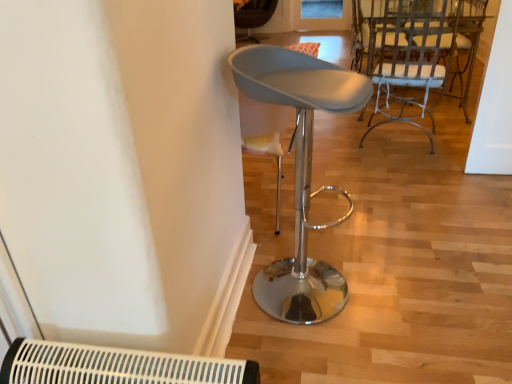
What do you see at coordinates (418, 52) in the screenshot? The width and height of the screenshot is (512, 384). I see `white painted metal chair at upper right, the 1th chair from the right` at bounding box center [418, 52].

Where is `velvet brown chair at center, the third chair in the bottom-to-top sequence`? velvet brown chair at center, the third chair in the bottom-to-top sequence is located at coordinates (252, 16).

Between white plastic air conditioning unit at lower left and white painted metal chair at upper right, the 2th chair viewed from the front, which one has smaller width?

Thinner between the two is white plastic air conditioning unit at lower left.

Between white plastic air conditioning unit at lower left and white painted metal chair at upper right, the 2th chair viewed from the front, which one is positioned in front?

Positioned in front is white plastic air conditioning unit at lower left.

What's the angular difference between white plastic air conditioning unit at lower left and white painted metal chair at upper right, which is counted as the 2th chair, starting from the bottom,'s facing directions?

104 degrees.

Is white plastic air conditioning unit at lower left next to white painted metal chair at upper right, the 2th chair viewed from the front?

white plastic air conditioning unit at lower left and white painted metal chair at upper right, the 2th chair viewed from the front, are not in contact.

From the image's perspective, would you say white painted metal chair at upper right, the second chair from the back, is positioned over matte gray stool at center, marked as the 2th chair in a left-to-right arrangement?

Yes, from the image's perspective, white painted metal chair at upper right, the second chair from the back, is on top of matte gray stool at center, marked as the 2th chair in a left-to-right arrangement.

Is white painted metal chair at upper right, which is the 2th chair in top-to-bottom order, looking in the opposite direction of matte gray stool at center, which appears as the 2th chair when viewed from the right?

That's not correct — white painted metal chair at upper right, which is the 2th chair in top-to-bottom order, is not looking away from matte gray stool at center, which appears as the 2th chair when viewed from the right.

Is there a large distance between white painted metal chair at upper right, the 2th chair viewed from the front, and matte gray stool at center, arranged as the 1th chair when ordered from the bottom?

Yes, white painted metal chair at upper right, the 2th chair viewed from the front, and matte gray stool at center, arranged as the 1th chair when ordered from the bottom, are located far from each other.

From a real-world perspective, between white painted metal chair at upper right, which is counted as the 2th chair, starting from the bottom, and matte gray stool at center, which ranks as the third chair in top-to-bottom order, who is vertically higher?

matte gray stool at center, which ranks as the third chair in top-to-bottom order, from a real-world perspective.

From a real-world perspective, is matte gray stool at center, arranged as the 1th chair when ordered from the bottom, physically below velvet brown chair at center, marked as the third chair in a front-to-back arrangement?

Incorrect, from a real-world perspective, matte gray stool at center, arranged as the 1th chair when ordered from the bottom, is higher than velvet brown chair at center, marked as the third chair in a front-to-back arrangement.

Considering the positions of objects matte gray stool at center, the third chair viewed from the back, and velvet brown chair at center, the third chair in the bottom-to-top sequence, in the image provided, who is behind, matte gray stool at center, the third chair viewed from the back, or velvet brown chair at center, the third chair in the bottom-to-top sequence,?

Positioned behind is velvet brown chair at center, the third chair in the bottom-to-top sequence.

Find the location of a particular element. The image size is (512, 384). the 2nd chair in front of the velvet brown chair at center, the 1th chair viewed from the top, starting your count from the anchor is located at coordinates (300, 172).

Considering the positions of objects matte gray stool at center, which ranks as the third chair in top-to-bottom order, and velvet brown chair at center, the third chair positioned from the right, in the image provided, who is more to the right, matte gray stool at center, which ranks as the third chair in top-to-bottom order, or velvet brown chair at center, the third chair positioned from the right,?

From the viewer's perspective, matte gray stool at center, which ranks as the third chair in top-to-bottom order, appears more on the right side.

Identify the location of chair behind the white painted metal chair at upper right, the 2th chair viewed from the front. (x=252, y=16).

Consider the image. Would you say velvet brown chair at center, the third chair in the bottom-to-top sequence, is part of white painted metal chair at upper right, which is counted as the 2th chair, starting from the bottom,'s contents?

No, velvet brown chair at center, the third chair in the bottom-to-top sequence, is not surrounded by white painted metal chair at upper right, which is counted as the 2th chair, starting from the bottom.

Which point is more distant from viewer, (x=455, y=52) or (x=264, y=16)?

Point (x=455, y=52)

Between point (249, 38) and point (425, 103), which one is positioned in front?

The point (249, 38) is closer.

Which of these two, velvet brown chair at center, arranged as the first chair when viewed from the left, or white painted metal chair at upper right, the 2th chair viewed from the front, stands shorter?

With less height is velvet brown chair at center, arranged as the first chair when viewed from the left.

The width and height of the screenshot is (512, 384). There is a velvet brown chair at center, the 1th chair viewed from the top. Identify the location of the 1st chair above it (from a real-world perspective). (418, 52).

Based on their sizes in the image, would you say velvet brown chair at center, the third chair positioned from the right, is bigger or smaller than white painted metal chair at upper right, which is the 3th chair in left-to-right order?

velvet brown chair at center, the third chair positioned from the right, is bigger than white painted metal chair at upper right, which is the 3th chair in left-to-right order.

From a real-world perspective, which object stands above the other?

matte gray stool at center, the 1th chair in the front-to-back sequence, is physically above.

Which chair is the 1st one when counting from the back of the white plastic air conditioning unit at lower left? Please provide its 2D coordinates.

[(300, 172)]

Considering the sizes of objects white plastic air conditioning unit at lower left and matte gray stool at center, the third chair viewed from the back, in the image provided, who is smaller, white plastic air conditioning unit at lower left or matte gray stool at center, the third chair viewed from the back,?

Smaller between the two is white plastic air conditioning unit at lower left.

In the scene shown: Is white plastic air conditioning unit at lower left wider or thinner than matte gray stool at center, arranged as the 1th chair when ordered from the bottom?

In the image, white plastic air conditioning unit at lower left appears to be more narrow than matte gray stool at center, arranged as the 1th chair when ordered from the bottom.

Who is taller, velvet brown chair at center, the third chair in the bottom-to-top sequence, or white plastic air conditioning unit at lower left?

velvet brown chair at center, the third chair in the bottom-to-top sequence, is taller.

Measure the distance from velvet brown chair at center, marked as the third chair in a front-to-back arrangement, to white plastic air conditioning unit at lower left.

velvet brown chair at center, marked as the third chair in a front-to-back arrangement, and white plastic air conditioning unit at lower left are 1.84 meters apart.

Is velvet brown chair at center, the third chair positioned from the right, surrounding white plastic air conditioning unit at lower left?

No, white plastic air conditioning unit at lower left is not a part of velvet brown chair at center, the third chair positioned from the right.

Is velvet brown chair at center, the 1th chair viewed from the top, positioned far away from white plastic air conditioning unit at lower left?

Yes, velvet brown chair at center, the 1th chair viewed from the top, and white plastic air conditioning unit at lower left are located far from each other.

You are a GUI agent. You are given a task and a screenshot of the screen. Output one action in this format:
    pyautogui.click(x=<x>, y=<y>)
    Task: Click on the air conditioning below the white painted metal chair at upper right, which is counted as the 2th chair, starting from the bottom (from a real-world perspective)
    This screenshot has width=512, height=384.
    Given the screenshot: What is the action you would take?
    pyautogui.click(x=116, y=366)

Find the location of `chair on the right of matte gray stool at center, arranged as the 1th chair when ordered from the bottom`. chair on the right of matte gray stool at center, arranged as the 1th chair when ordered from the bottom is located at coordinates (418, 52).

From the image, which object appears to be farther from matte gray stool at center, the 1th chair in the front-to-back sequence, white plastic air conditioning unit at lower left or velvet brown chair at center, the third chair in the bottom-to-top sequence?

velvet brown chair at center, the third chair in the bottom-to-top sequence.

Looking at the image, which one is located further to matte gray stool at center, which appears as the 2th chair when viewed from the right, velvet brown chair at center, marked as the third chair in a front-to-back arrangement, or white plastic air conditioning unit at lower left?

Among the two, velvet brown chair at center, marked as the third chair in a front-to-back arrangement, is located further to matte gray stool at center, which appears as the 2th chair when viewed from the right.

Estimate the real-world distances between objects in this image. Which object is further from white plastic air conditioning unit at lower left, white painted metal chair at upper right, the 2th chair viewed from the front, or matte gray stool at center, marked as the 2th chair in a left-to-right arrangement?

white painted metal chair at upper right, the 2th chair viewed from the front, is further to white plastic air conditioning unit at lower left.

Based on their spatial positions, is white painted metal chair at upper right, which is the 2th chair in top-to-bottom order, or white plastic air conditioning unit at lower left further from matte gray stool at center, marked as the 2th chair in a left-to-right arrangement?

Based on the image, white painted metal chair at upper right, which is the 2th chair in top-to-bottom order, appears to be further to matte gray stool at center, marked as the 2th chair in a left-to-right arrangement.

Considering their positions, is velvet brown chair at center, the 1th chair viewed from the top, positioned closer to white plastic air conditioning unit at lower left than matte gray stool at center, the 1th chair in the front-to-back sequence?

matte gray stool at center, the 1th chair in the front-to-back sequence, lies closer to white plastic air conditioning unit at lower left than the other object.

From the image, which object appears to be farther from white painted metal chair at upper right, which is counted as the 2th chair, starting from the bottom, matte gray stool at center, the 1th chair in the front-to-back sequence, or white plastic air conditioning unit at lower left?

white plastic air conditioning unit at lower left lies further to white painted metal chair at upper right, which is counted as the 2th chair, starting from the bottom, than the other object.

Which object lies nearer to the anchor point velvet brown chair at center, arranged as the first chair when viewed from the left, matte gray stool at center, which appears as the 2th chair when viewed from the right, or white painted metal chair at upper right, which is the 2th chair in top-to-bottom order?

Among the two, white painted metal chair at upper right, which is the 2th chair in top-to-bottom order, is located nearer to velvet brown chair at center, arranged as the first chair when viewed from the left.

Considering their positions, is white painted metal chair at upper right, which is the 2th chair in top-to-bottom order, positioned closer to matte gray stool at center, arranged as the 1th chair when ordered from the bottom, than velvet brown chair at center, the third chair positioned from the right?

velvet brown chair at center, the third chair positioned from the right.

Find the location of `chair between matte gray stool at center, marked as the 2th chair in a left-to-right arrangement, and velvet brown chair at center, the first chair when ordered from back to front, in the front-back direction`. chair between matte gray stool at center, marked as the 2th chair in a left-to-right arrangement, and velvet brown chair at center, the first chair when ordered from back to front, in the front-back direction is located at coordinates (418, 52).

At what (x,y) coordinates should I click in order to perform the action: click on chair located between white plastic air conditioning unit at lower left and white painted metal chair at upper right, the second chair from the back, in the depth direction. Please return your answer as a coordinate pair (x, y). Looking at the image, I should click on (300, 172).